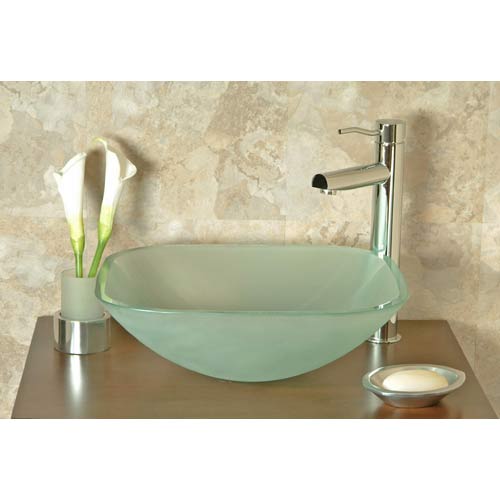
Where is `bowl`? This screenshot has height=500, width=500. bowl is located at coordinates (426, 398).